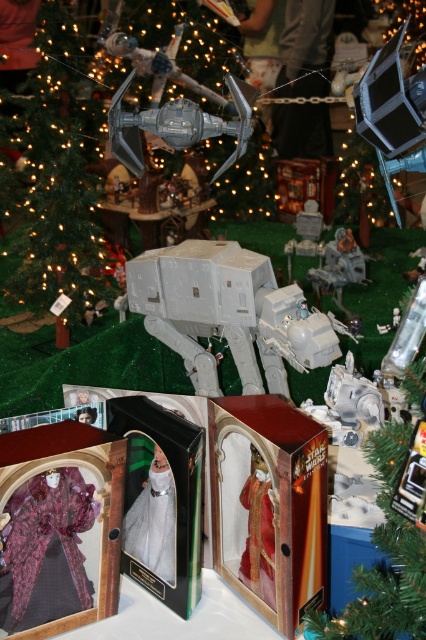
Question: Which object is the closest to the white plastic at-at walker at center?

Choices:
 (A) white matte at-at walker at center
 (B) green matte christmas tree at upper left

Answer: (A)

Question: Estimate the real-world distances between objects in this image. Which object is farther from the white matte at-at walker at center?

Choices:
 (A) white plastic at-at walker at center
 (B) green matte christmas tree at upper left

Answer: (B)

Question: Can you confirm if green matte christmas tree at upper left is positioned below white matte at-at walker at center?

Choices:
 (A) no
 (B) yes

Answer: (A)

Question: Does green matte christmas tree at upper left have a lesser width compared to white matte at-at walker at center?

Choices:
 (A) yes
 (B) no

Answer: (B)

Question: Can you confirm if green matte christmas tree at upper left is smaller than white plastic at-at walker at center?

Choices:
 (A) yes
 (B) no

Answer: (B)

Question: Which object is positioned farthest from the white plastic at-at walker at center?

Choices:
 (A) green matte christmas tree at upper left
 (B) white matte at-at walker at center

Answer: (A)